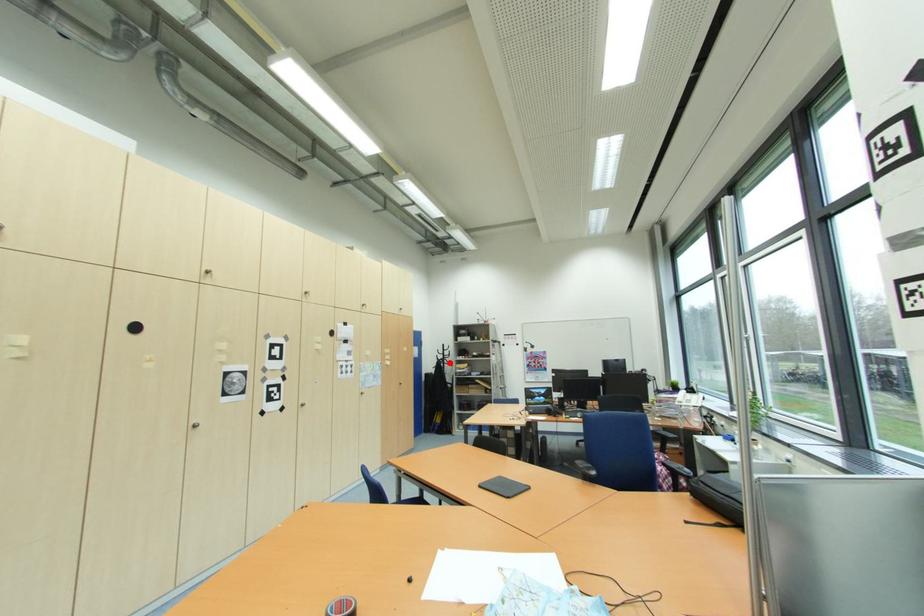
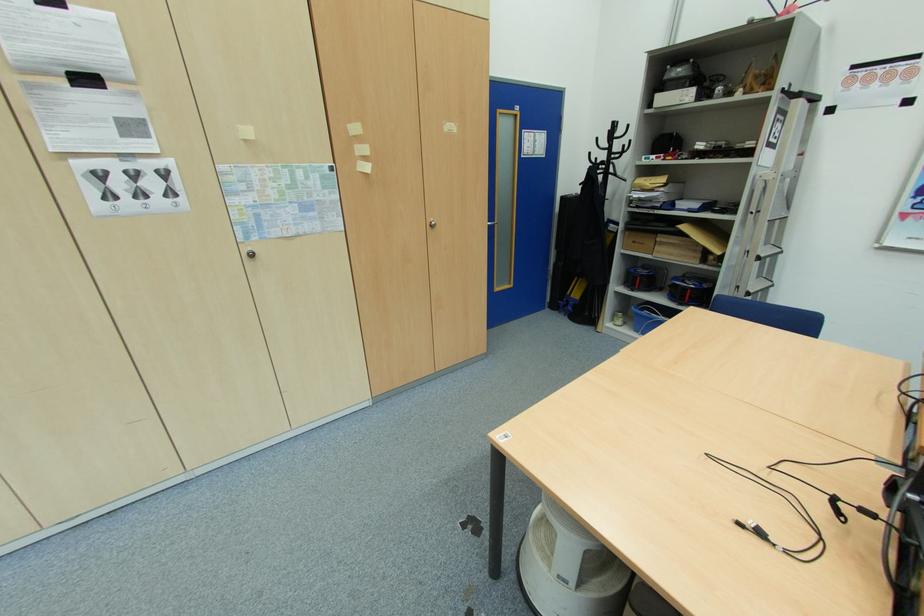
Question: A red point is marked in image1. In image2, is the corresponding 3D point closer to the camera or farther? Reply with the corresponding letter.

Choices:
 (A) The corresponding 3D point is closer.
 (B) The corresponding 3D point is farther.

Answer: (A)